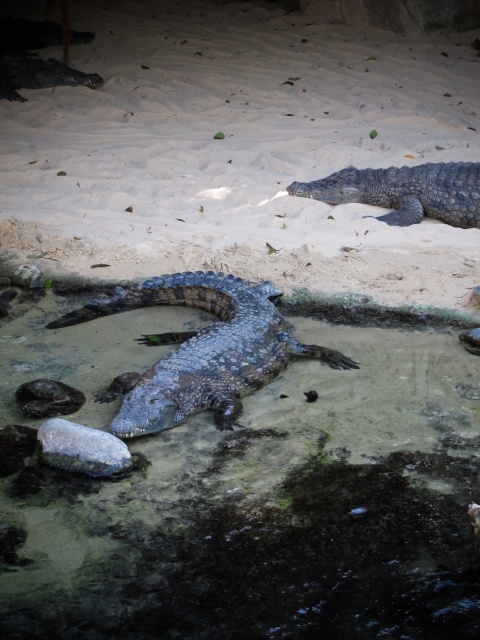
Who is more distant from viewer, (115, 611) or (86, 310)?

The point (86, 310) is behind.

Does sandy textured mud at center have a greater height compared to shiny gray crocodile at center?

Indeed, sandy textured mud at center has a greater height compared to shiny gray crocodile at center.

Is point (439, 394) positioned after point (238, 353)?

That is True.

Find the location of a particular element. Image resolution: width=480 pixels, height=640 pixels. sandy textured mud at center is located at coordinates (244, 492).

Is shiny gray crocodile at center below gray scaly crocodile at upper right?

Yes.

Is point (139, 428) less distant than point (351, 172)?

That is True.

Is point (169, 356) behind point (477, 202)?

No.

This screenshot has height=640, width=480. Find the location of `shiny gray crocodile at center`. shiny gray crocodile at center is located at coordinates (204, 349).

Based on the photo, which is above, sandy textured mud at center or gray scaly crocodile at upper right?

gray scaly crocodile at upper right is above.

Can you confirm if sandy textured mud at center is taller than gray scaly crocodile at upper right?

Yes, sandy textured mud at center is taller than gray scaly crocodile at upper right.

Between point (373, 602) and point (362, 172), which one is positioned in front?

Point (373, 602) is more forward.

Identify the location of sandy textured mud at center. The width and height of the screenshot is (480, 640). (244, 492).